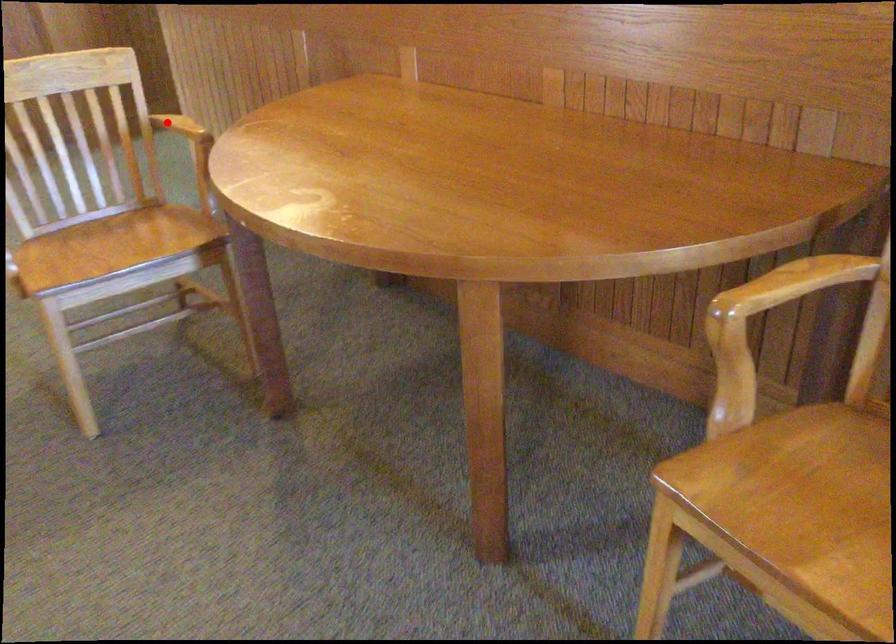
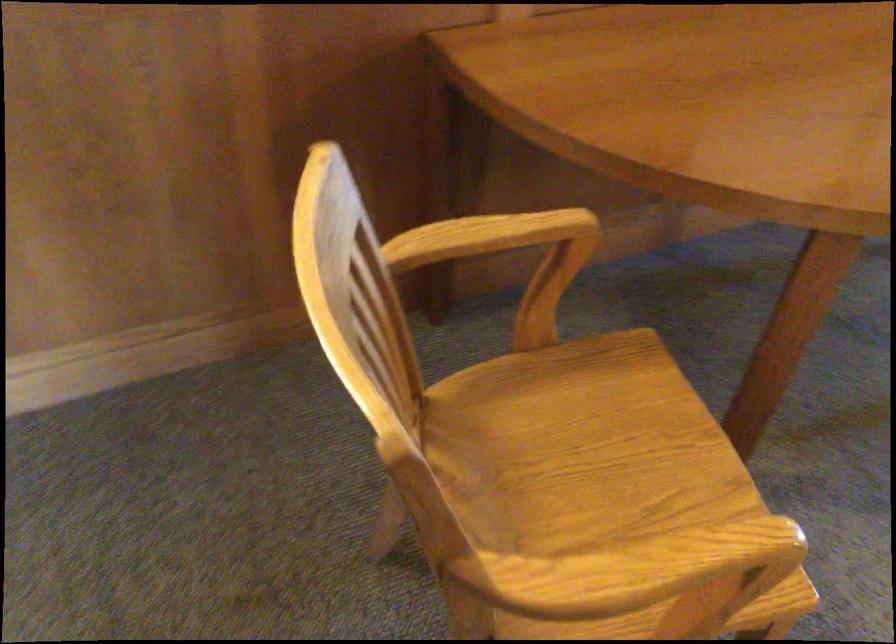
Question: A red point is marked in image1. In image2, is the corresponding 3D point closer to the camera or farther? Reply with the corresponding letter.

Choices:
 (A) The corresponding 3D point is closer.
 (B) The corresponding 3D point is farther.

Answer: (A)